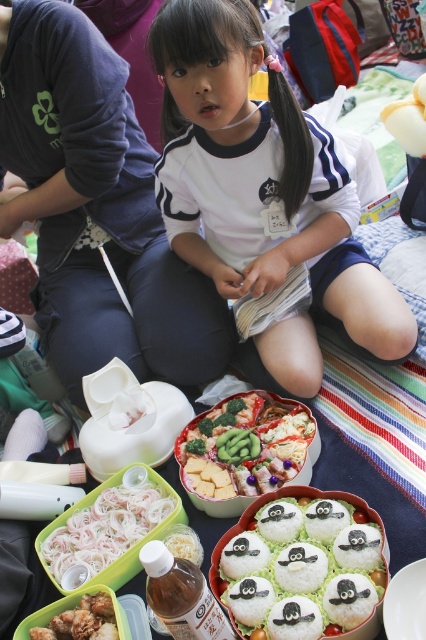
Question: Among these objects, which one is farthest from the camera?

Choices:
 (A) white cotton shirt at center
 (B) vibrant green vegetables at center
 (C) shiny plastic container at lower left
 (D) white rice with penguin designs at center

Answer: (B)

Question: Which point appears closest to the camera in this image?

Choices:
 (A) (36, 630)
 (B) (253, 138)
 (C) (51, 557)

Answer: (A)

Question: Is white cotton shirt at center smaller than white rice with penguin designs at center?

Choices:
 (A) no
 (B) yes

Answer: (A)

Question: Which point is closer to the camera taking this photo?

Choices:
 (A) (173, 200)
 (B) (284, 534)
 (C) (187, 477)
 (D) (86, 605)

Answer: (D)

Question: From the image, what is the correct spatial relationship of white translucent noodles at lower left in relation to shiny plastic container at lower left?

Choices:
 (A) left
 (B) right

Answer: (B)

Question: Can you confirm if white cotton shirt at center is bigger than vibrant green vegetables at center?

Choices:
 (A) yes
 (B) no

Answer: (A)